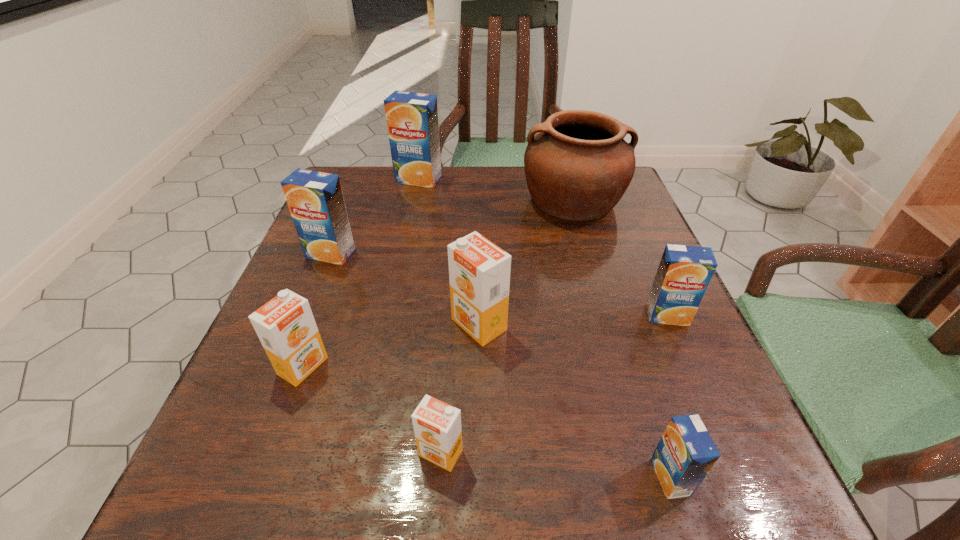
You are a GUI agent. You are given a task and a screenshot of the screen. Output one action in this format:
    pyautogui.click(x=<x>, y=<y>)
    Task: Click on the free location that satisfies the following two spatial constraints: 1. on the back side of the sixth object from right to left; 2. on the right side of the third farthest object
    
    Given the screenshot: What is the action you would take?
    pyautogui.click(x=360, y=179)

Identify the location of free space that satisfies the following two spatial constraints: 1. on the back side of the second farthest orange juice; 2. on the right side of the tallest orange juice. This screenshot has height=540, width=960. (360, 179).